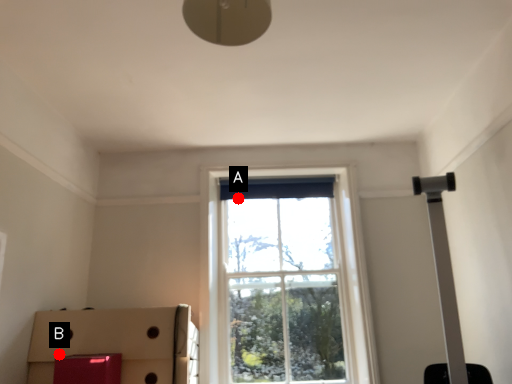
Question: Two points are circled on the image, labeled by A and B beside each circle. Which point is further to the camera?

Choices:
 (A) A is further
 (B) B is further

Answer: (A)